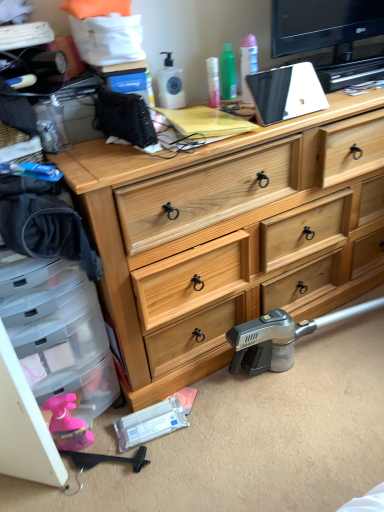
Find the location of a particular element. free space to the left of black plastic hammer at lower left is located at coordinates (56, 484).